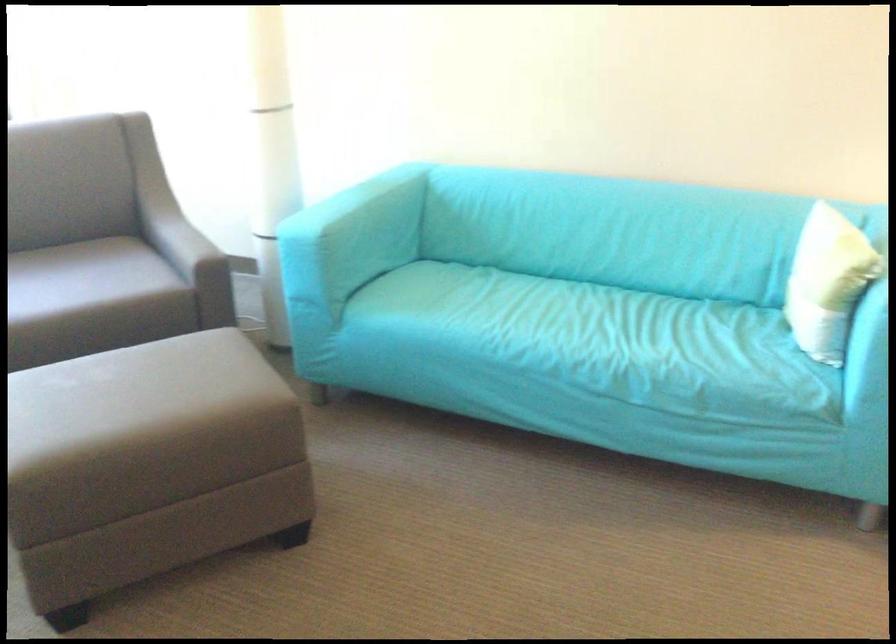
Find where to sit the chair sitting surface. Please return your answer as a coordinate pair (x, y).

(53, 298)